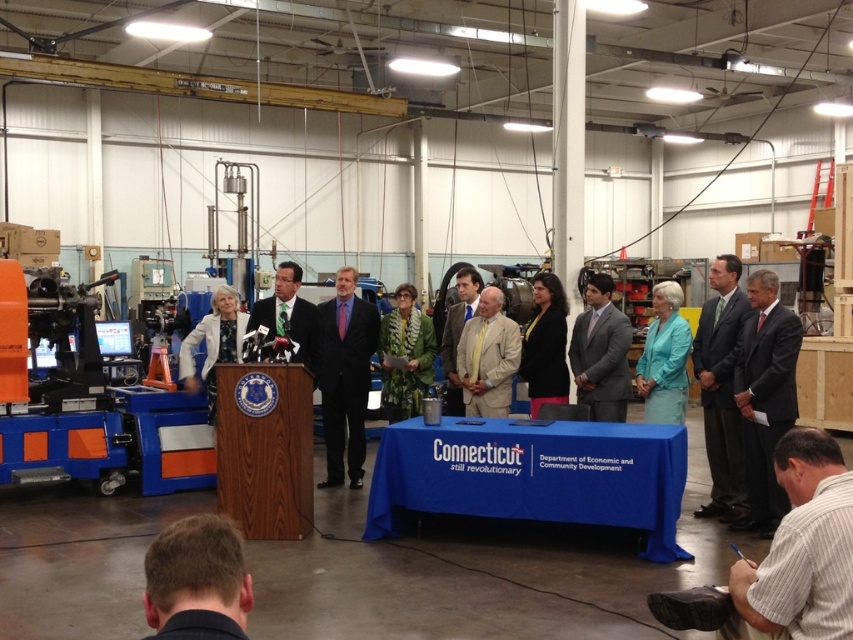
Question: From the image, what is the correct spatial relationship of dark suit at right in relation to green fabric suit at center?

Choices:
 (A) above
 (B) below

Answer: (B)

Question: Is black matte jacket at center to the right of green fabric suit at center from the viewer's perspective?

Choices:
 (A) no
 (B) yes

Answer: (B)

Question: Is gray suit at center to the right of light brown suit at center from the viewer's perspective?

Choices:
 (A) no
 (B) yes

Answer: (B)

Question: Which object appears closest to the camera in this image?

Choices:
 (A) green textured coat at center
 (B) gray suit at center

Answer: (B)

Question: Among these points, which one is nearest to the camera?

Choices:
 (A) (235, 362)
 (B) (561, 371)
 (C) (646, 417)
 (D) (451, 401)

Answer: (C)

Question: Estimate the real-world distances between objects in this image. Which object is closer to the white striped shirt at lower right?

Choices:
 (A) gray suit at center
 (B) dark suit at right
 (C) teal fabric jacket at center
 (D) brown hair at lower left

Answer: (D)